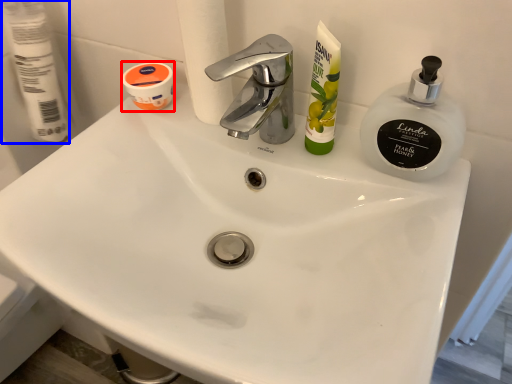
Question: Among these objects, which one is farthest to the camera, mouthwash (highlighted by a red box) or toilet paper (highlighted by a blue box)?

Choices:
 (A) mouthwash
 (B) toilet paper

Answer: (A)